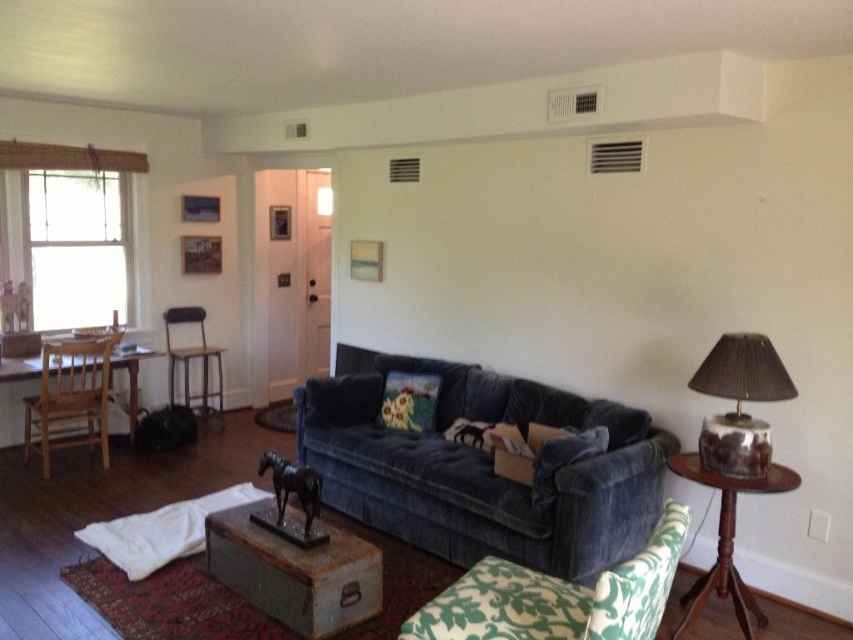
You are standing in the living room and want to sit down. Which chair, the green floral fabric armchair at lower right or the wooden chair at left, is closer to you?

A: The green floral fabric armchair at lower right is closer to the viewer than the wooden chair at left, so you should choose the green floral fabric armchair at lower right.